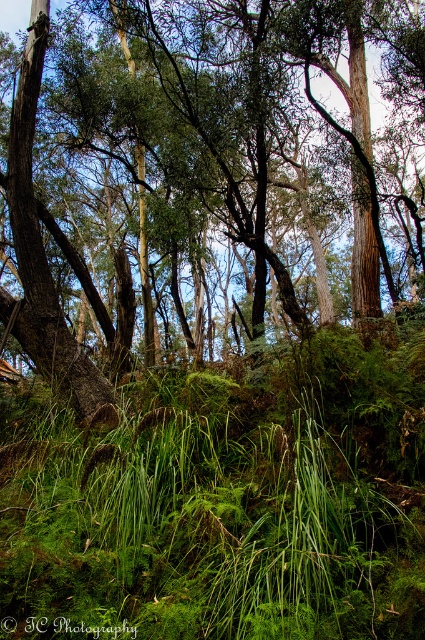
Which is above, green leafy tree at center or green leafy grass at center?

Positioned higher is green leafy tree at center.

Is point (119, 4) in front of point (402, 545)?

No, it is not.

Locate an element on the screen. green leafy tree at center is located at coordinates (217, 156).